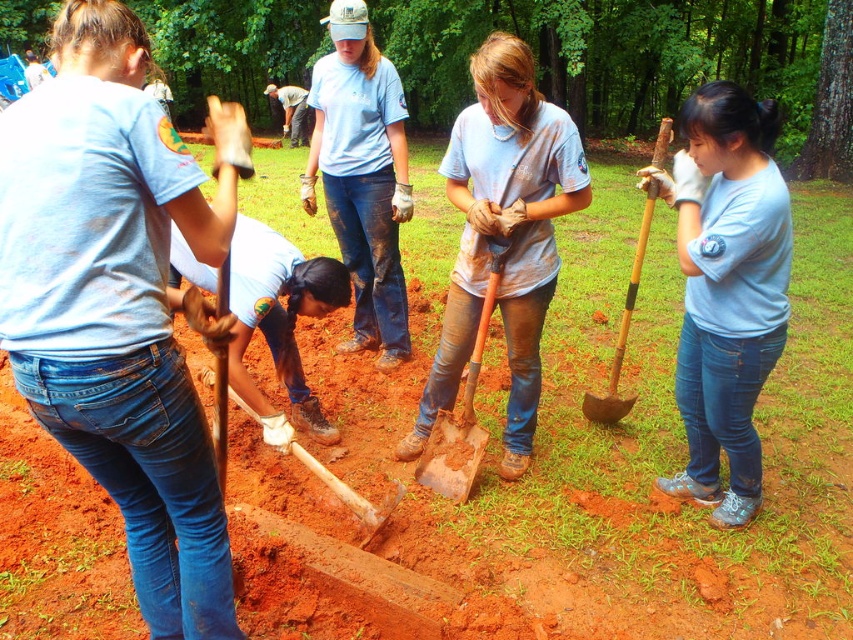
You are a photographer trying to capture a clear shot of the blue jeans at center and the white matte shovel at center. Which object should you zoom in on to ensure it appears thicker in the photo?

The white matte shovel at center should be zoomed in on because it is thicker than the blue jeans at center, making it easier to capture a thicker appearance.

You are a photographer trying to capture a clear image of both the blue jeans at center and the white matte shovel at center. Since you want to ensure both are in focus, you need to know which object is taller. Can you tell me which one is taller?

The blue jeans at center is taller than the white matte shovel at center.